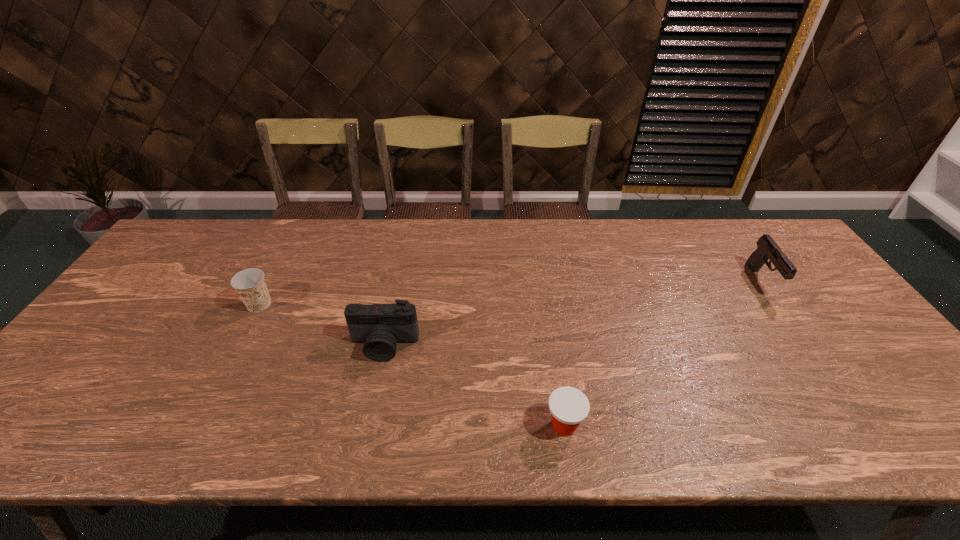
Find the location of a particular element. Image resolution: width=960 pixels, height=540 pixels. object that is the second closest to the left Dixie cup is located at coordinates (569, 407).